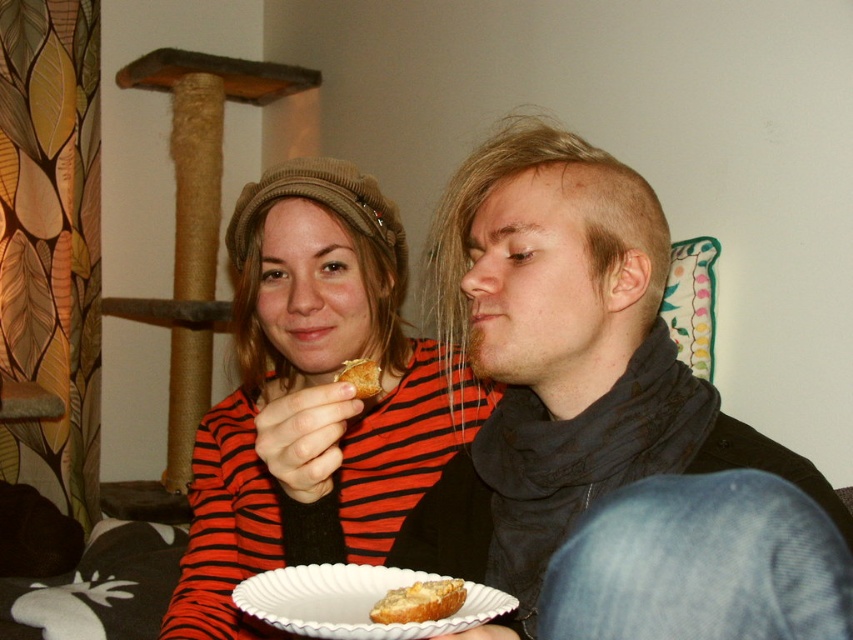
What do you see at coordinates (419, 602) in the screenshot? I see `golden brown bread at lower center` at bounding box center [419, 602].

Who is lower down, golden brown bread at lower center or golden crumbly pastry at center?

Positioned lower is golden brown bread at lower center.

Between point (421, 598) and point (364, 369), which one is positioned behind?

The point (364, 369) is more distant.

The image size is (853, 640). I want to click on golden brown bread at lower center, so click(419, 602).

Is black matte scarf at center below golden crumbly pastry at center?

Indeed, black matte scarf at center is positioned under golden crumbly pastry at center.

Looking at this image, is black matte scarf at center bigger than golden crumbly pastry at center?

Correct, black matte scarf at center is larger in size than golden crumbly pastry at center.

I want to click on black matte scarf at center, so click(607, 428).

Identify the location of black matte scarf at center. (607, 428).

Can you confirm if white paper plate at lower center is shorter than golden brown bread at lower center?

No, white paper plate at lower center is not shorter than golden brown bread at lower center.

Between white paper plate at lower center and golden brown bread at lower center, which one has more height?

Standing taller between the two is white paper plate at lower center.

The width and height of the screenshot is (853, 640). Identify the location of white paper plate at lower center. (354, 602).

Where is `white paper plate at lower center`? The width and height of the screenshot is (853, 640). white paper plate at lower center is located at coordinates (354, 602).